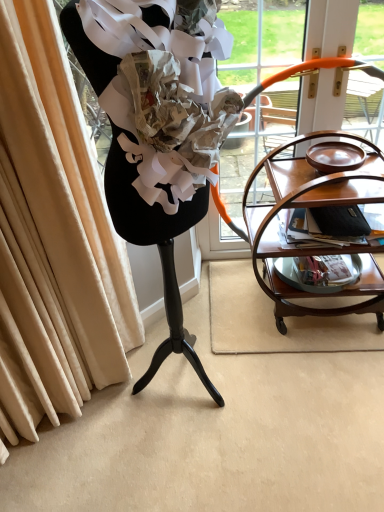
Question: In terms of height, does mahogany wood serving cart at right look taller or shorter compared to matte brown magazine at right?

Choices:
 (A) short
 (B) tall

Answer: (B)

Question: In terms of size, does mahogany wood serving cart at right appear bigger or smaller than matte brown magazine at right?

Choices:
 (A) small
 (B) big

Answer: (B)

Question: Estimate the real-world distances between objects in this image. Which object is closer to the matte brown magazine at right?

Choices:
 (A) mahogany wood serving cart at right
 (B) wooden tea cart at right

Answer: (A)

Question: Which object is the farthest from the wooden tea cart at right?

Choices:
 (A) matte brown magazine at right
 (B) mahogany wood serving cart at right

Answer: (A)